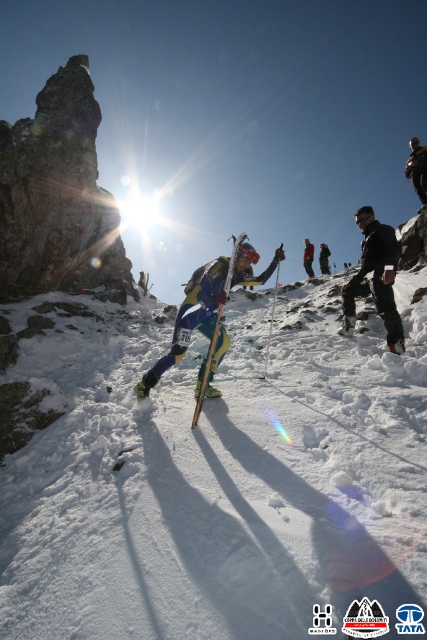
Question: Which object is the farthest from the yellow fabric jacket at upper center?

Choices:
 (A) yellow matte ski at center
 (B) yellow-green ski suit at center

Answer: (A)

Question: Considering the real-world distances, which object is farthest from the black matte jacket at center?

Choices:
 (A) white powdery snow at center
 (B) black ski suit at center
 (C) yellow-green ski suit at center
 (D) yellow fabric jacket at upper center

Answer: (D)

Question: Is the position of white powdery snow at center less distant than that of yellow-green ski suit at center?

Choices:
 (A) no
 (B) yes

Answer: (B)

Question: Does yellow matte ski at center appear on the left side of yellow fabric jacket at upper center?

Choices:
 (A) yes
 (B) no

Answer: (A)

Question: Is yellow-green ski suit at center closer to camera compared to yellow fabric jacket at upper center?

Choices:
 (A) no
 (B) yes

Answer: (B)

Question: Among these objects, which one is nearest to the camera?

Choices:
 (A) yellow-green ski suit at center
 (B) white powdery snow at center
 (C) yellow matte ski at center

Answer: (B)